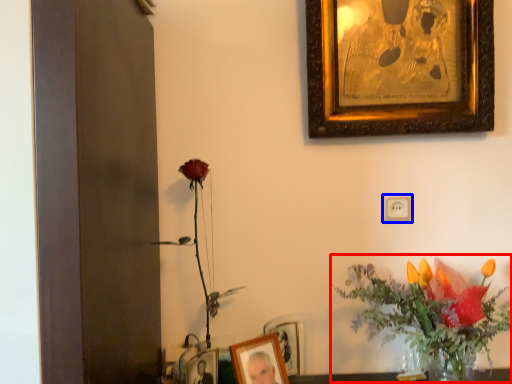
Question: Among these objects, which one is farthest to the camera, floral arrangement (highlighted by a red box) or electric outlet (highlighted by a blue box)?

Choices:
 (A) floral arrangement
 (B) electric outlet

Answer: (B)